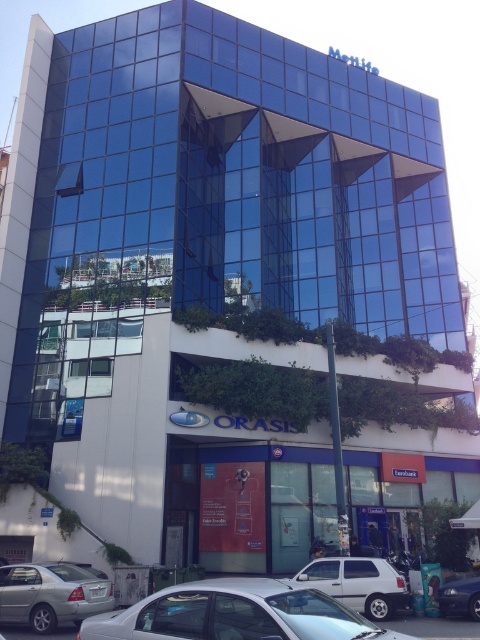
Question: Can you confirm if silver metallic sedan at lower left is positioned above white matte car at lower center?

Choices:
 (A) yes
 (B) no

Answer: (A)

Question: Among these points, which one is farthest from the camera?

Choices:
 (A) (459, 595)
 (B) (232, 632)

Answer: (A)

Question: Based on their relative distances, which object is farther from the white matte car at lower center?

Choices:
 (A) silver metallic sedan at lower left
 (B) shiny blue sedan at lower right

Answer: (A)

Question: Which object is positioned closest to the shiny blue sedan at lower right?

Choices:
 (A) white matte car at lower center
 (B) silver metallic sedan at lower left
 (C) silver metallic car at lower center

Answer: (A)

Question: Does silver metallic car at lower center have a lesser width compared to shiny blue sedan at lower right?

Choices:
 (A) no
 (B) yes

Answer: (A)

Question: In this image, where is silver metallic car at lower center located relative to white matte car at lower center?

Choices:
 (A) left
 (B) right

Answer: (A)